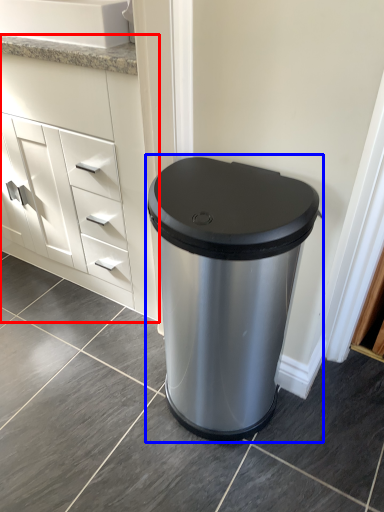
Question: Which object appears closest to the camera in this image, chest of drawers (highlighted by a red box) or waste container (highlighted by a blue box)?

Choices:
 (A) chest of drawers
 (B) waste container

Answer: (B)